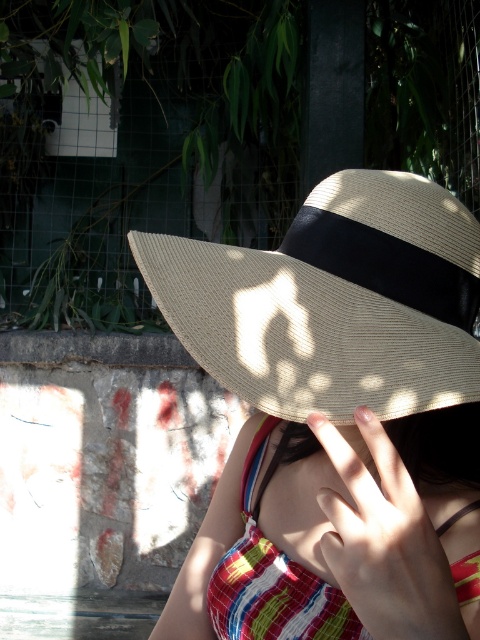
Question: Is natural straw hat at center to the left of striped fabric bikini top at center from the viewer's perspective?

Choices:
 (A) no
 (B) yes

Answer: (B)

Question: Does natural straw hat at center have a greater width compared to striped fabric bikini top at center?

Choices:
 (A) yes
 (B) no

Answer: (A)

Question: Which of the following is the closest to the observer?

Choices:
 (A) (336, 410)
 (B) (468, 429)

Answer: (A)

Question: Which point is farther to the camera?

Choices:
 (A) natural straw hat at center
 (B) striped fabric bikini top at center

Answer: (B)

Question: Considering the relative positions of natural straw hat at center and striped fabric bikini top at center in the image provided, where is natural straw hat at center located with respect to striped fabric bikini top at center?

Choices:
 (A) above
 (B) below

Answer: (A)